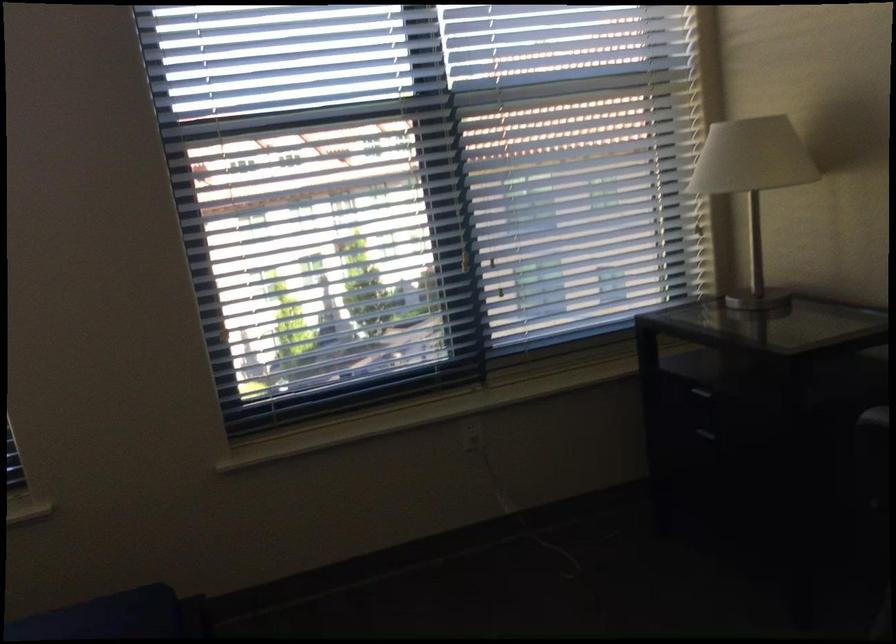
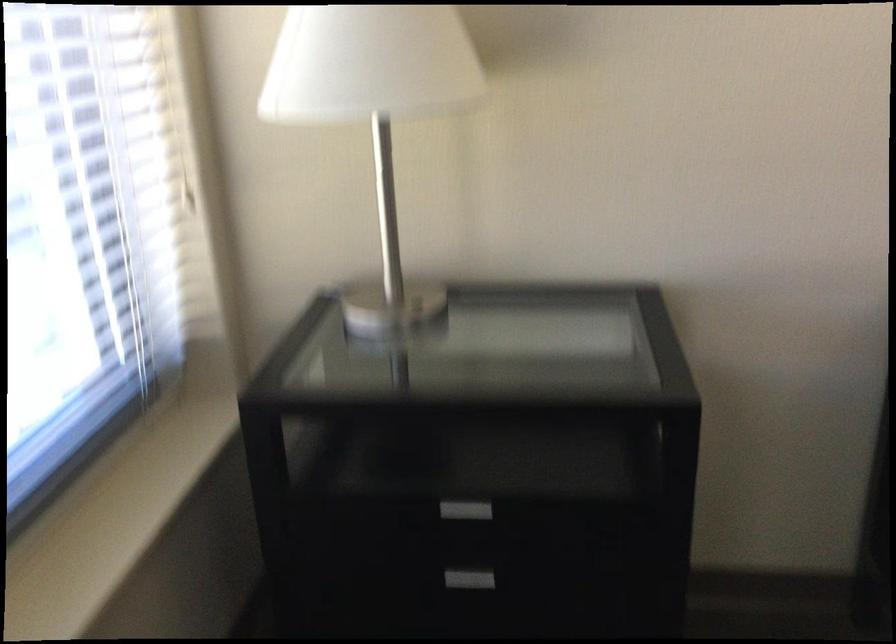
Where in the second image is the point corresponding to point (684, 409) from the first image?

(461, 511)